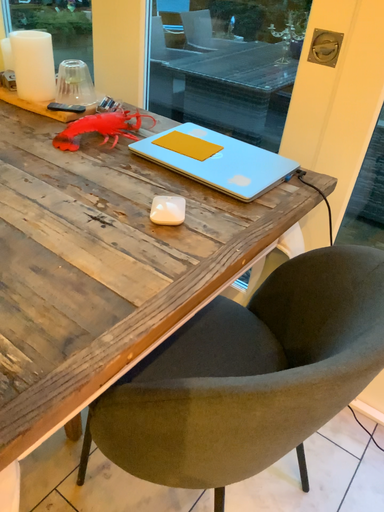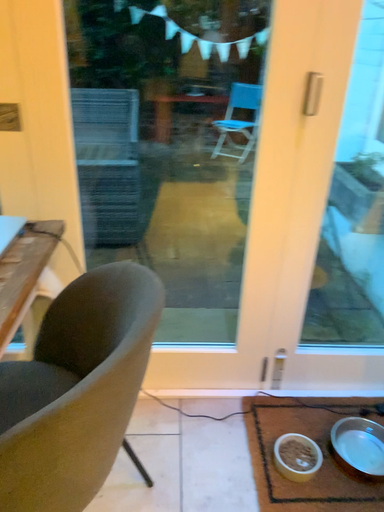
Question: Which way did the camera rotate in the video?

Choices:
 (A) rotated right
 (B) rotated left

Answer: (A)